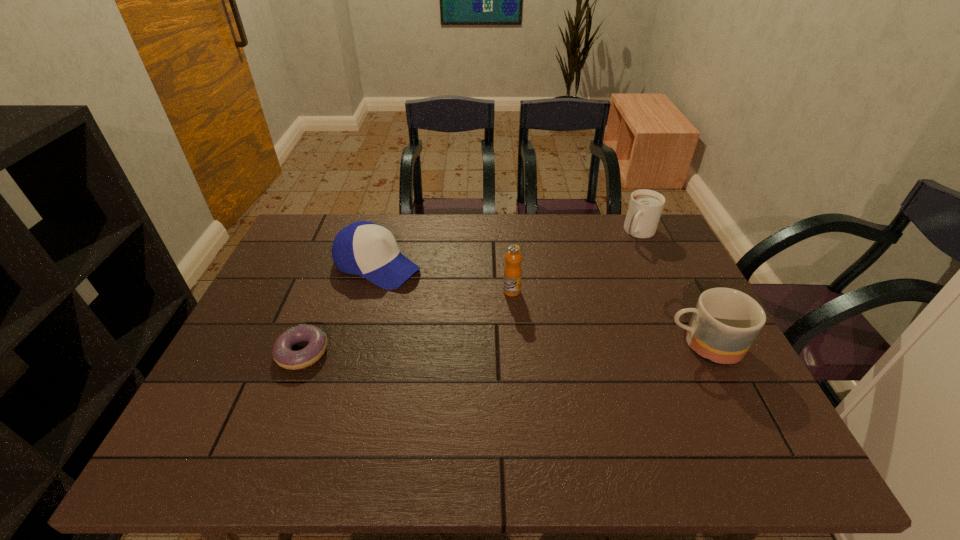
In order to click on free space that is in between the third object from right to left and the cappuccino in this screenshot , I will do `click(576, 262)`.

Where is `vacant space in between the mug and the shortest object`? This screenshot has height=540, width=960. vacant space in between the mug and the shortest object is located at coordinates (502, 349).

The width and height of the screenshot is (960, 540). Identify the location of empty space that is in between the mug and the cappuccino. (671, 289).

Where is `vacant region between the orange juice and the baseball cap`? vacant region between the orange juice and the baseball cap is located at coordinates (444, 278).

This screenshot has width=960, height=540. In order to click on free space between the baseball cap and the shortest object in this screenshot , I will do `click(340, 308)`.

You are a GUI agent. You are given a task and a screenshot of the screen. Output one action in this format:
    pyautogui.click(x=<x>, y=<y>)
    Task: Click on the vacant region between the third object from left to right and the doughnut
    Image resolution: width=960 pixels, height=540 pixels.
    Given the screenshot: What is the action you would take?
    pyautogui.click(x=407, y=322)

Identify the location of free space between the orange juice and the cappuccino. (576, 262).

Image resolution: width=960 pixels, height=540 pixels. I want to click on vacant space in between the mug and the baseball cap, so click(x=540, y=305).

Locate an element on the screen. The width and height of the screenshot is (960, 540). vacant space that's between the orange juice and the cappuccino is located at coordinates (576, 262).

Identify which object is the fourth closest to the mug. Please provide its 2D coordinates. Your answer should be formatted as a tuple, i.e. [(x, y)], where the tuple contains the x and y coordinates of a point satisfying the conditions above.

[(283, 355)]